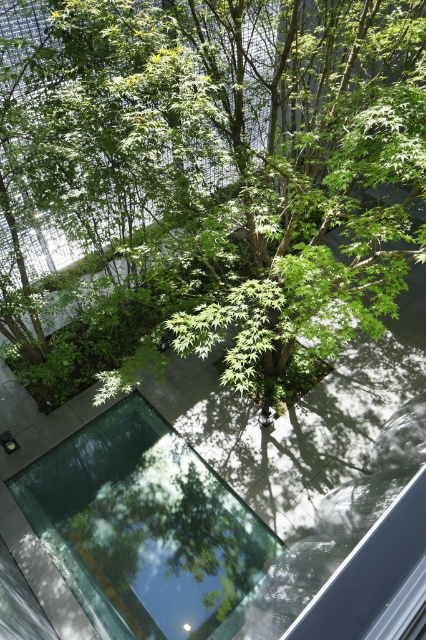
At what (x,y) coordinates should I click in order to perform the action: click on green leafy tree at center. Please return your answer as a coordinate pair (x, y). The width and height of the screenshot is (426, 640). Looking at the image, I should click on (236, 166).

This screenshot has height=640, width=426. Describe the element at coordinates (236, 166) in the screenshot. I see `green leafy tree at center` at that location.

This screenshot has width=426, height=640. I want to click on green leafy tree at center, so click(x=236, y=166).

Identify the location of green leafy tree at center. The image size is (426, 640). (236, 166).